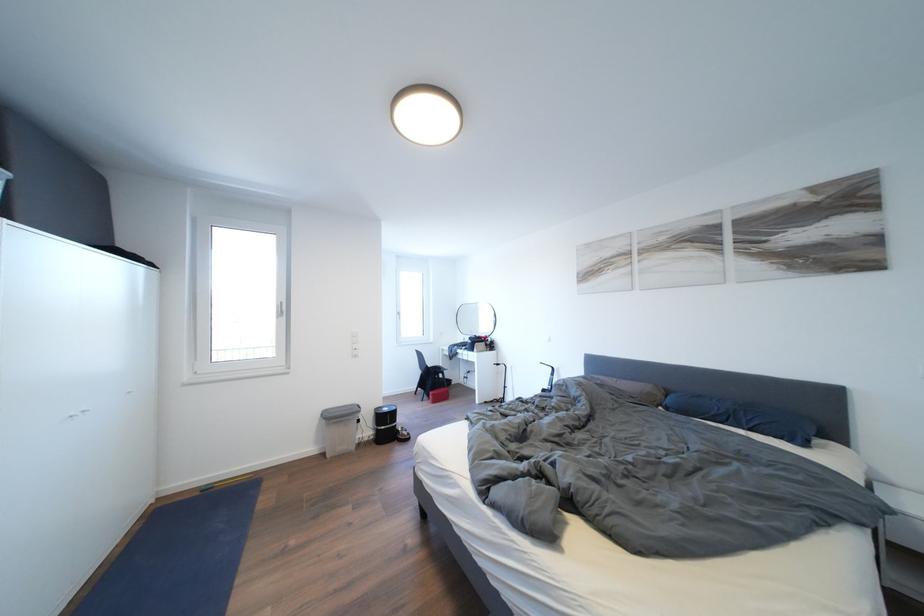
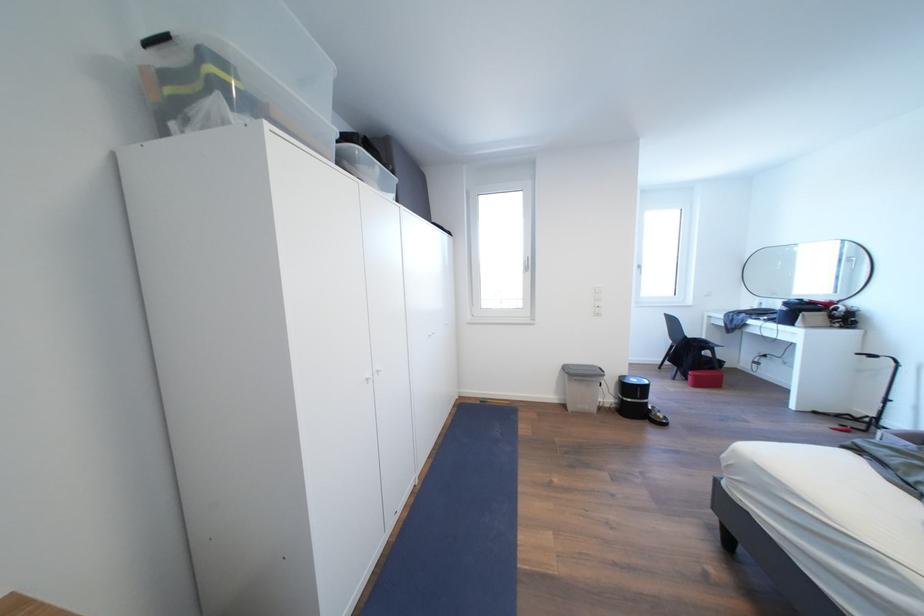
Locate, in the second image, the point that corresponds to point 337,421 in the first image.

(579, 377)